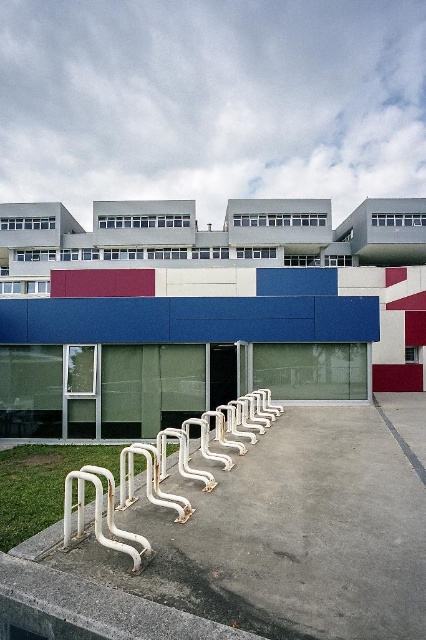
Question: Can you confirm if white smooth concrete at lower left is thinner than gray concrete line at center?

Choices:
 (A) no
 (B) yes

Answer: (A)

Question: Is white smooth concrete at lower left closer to camera compared to gray concrete line at center?

Choices:
 (A) no
 (B) yes

Answer: (B)

Question: Can you confirm if white smooth concrete at lower left is smaller than white matte rail at lower center?

Choices:
 (A) no
 (B) yes

Answer: (A)

Question: Which point is farther to the camera?

Choices:
 (A) (333, 408)
 (B) (112, 545)
 (C) (376, 400)

Answer: (C)

Question: Which point is farther to the camera?

Choices:
 (A) (264, 634)
 (B) (118, 506)
 (C) (397, 438)

Answer: (C)

Question: Among these objects, which one is nearest to the camera?

Choices:
 (A) white smooth concrete at lower left
 (B) white matte rail at lower center

Answer: (A)